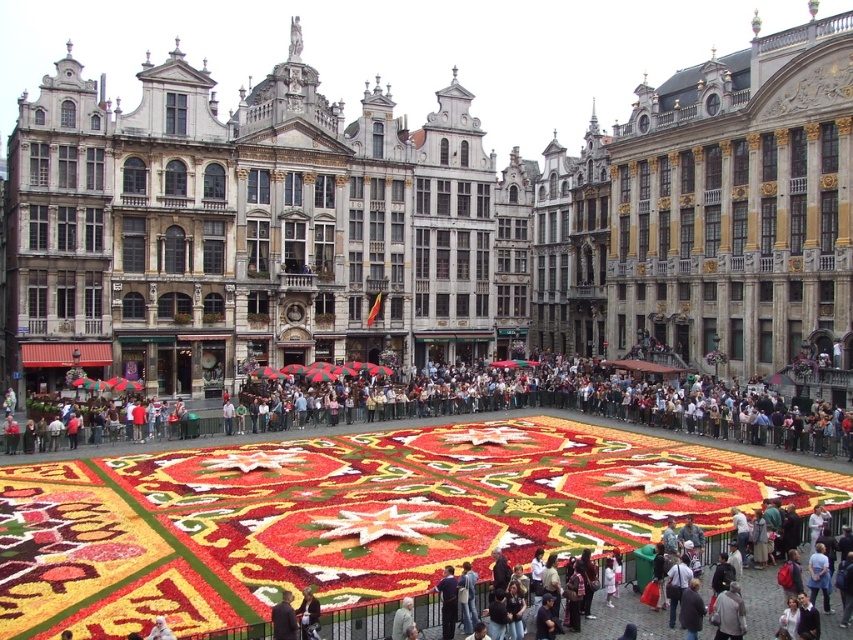
Measure the distance from stone building at center to multicolored fabric crowd at center.

stone building at center is 16.46 meters from multicolored fabric crowd at center.

Based on the photo, does stone building at center have a greater height compared to multicolored fabric crowd at center?

Indeed, stone building at center has a greater height compared to multicolored fabric crowd at center.

Is point (218, 365) farther from camera compared to point (758, 410)?

Yes, point (218, 365) is behind point (758, 410).

Locate an element on the screen. The width and height of the screenshot is (853, 640). stone building at center is located at coordinates (241, 230).

Is multicolored fabric crowd at center to the right of dark gray jacket at lower center from the viewer's perspective?

Yes, multicolored fabric crowd at center is to the right of dark gray jacket at lower center.

Who is shorter, multicolored fabric crowd at center or dark gray jacket at lower center?

With less height is dark gray jacket at lower center.

Is point (622, 378) positioned before point (291, 620)?

That is False.

Locate an element on the screen. multicolored fabric crowd at center is located at coordinates (566, 403).

From the picture: Does stone building at center lie behind dark gray jacket at lower center?

Yes, it is behind dark gray jacket at lower center.

Can you confirm if stone building at center is smaller than dark gray jacket at lower center?

No.

Locate an element on the screen. Image resolution: width=853 pixels, height=640 pixels. stone building at center is located at coordinates (241, 230).

You are a GUI agent. You are given a task and a screenshot of the screen. Output one action in this format:
    pyautogui.click(x=<x>, y=<y>)
    Task: Click on the stone building at center
    
    Given the screenshot: What is the action you would take?
    pyautogui.click(x=241, y=230)